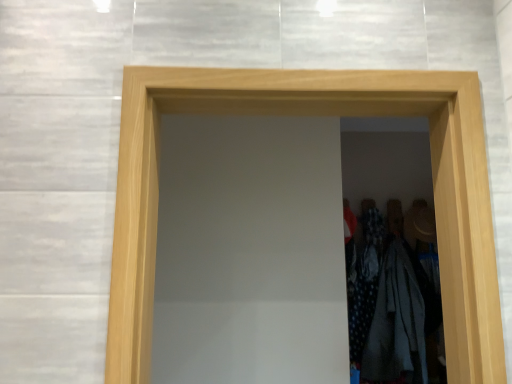
Question: Is polka dot fabric dress at right further to camera compared to natural wood door at center?

Choices:
 (A) no
 (B) yes

Answer: (B)

Question: Are polka dot fabric dress at right and natural wood door at center beside each other?

Choices:
 (A) yes
 (B) no

Answer: (B)

Question: Is polka dot fabric dress at right positioned with its back to natural wood door at center?

Choices:
 (A) yes
 (B) no

Answer: (B)

Question: Considering the relative sizes of polka dot fabric dress at right and natural wood door at center in the image provided, is polka dot fabric dress at right taller than natural wood door at center?

Choices:
 (A) no
 (B) yes

Answer: (B)

Question: Is there a large distance between polka dot fabric dress at right and natural wood door at center?

Choices:
 (A) yes
 (B) no

Answer: (A)

Question: Would you say natural wood door at center is inside or outside white cotton shirt at right?

Choices:
 (A) outside
 (B) inside

Answer: (A)

Question: From a real-world perspective, is natural wood door at center positioned above or below white cotton shirt at right?

Choices:
 (A) below
 (B) above

Answer: (B)

Question: In terms of size, does natural wood door at center appear bigger or smaller than white cotton shirt at right?

Choices:
 (A) small
 (B) big

Answer: (B)

Question: Is natural wood door at center in front of or behind white cotton shirt at right in the image?

Choices:
 (A) behind
 (B) front

Answer: (B)

Question: Is point (443, 306) positioned closer to the camera than point (355, 344)?

Choices:
 (A) closer
 (B) farther

Answer: (A)

Question: Relative to polka dot fabric dress at right, is natural wood door at center in front or behind?

Choices:
 (A) front
 (B) behind

Answer: (A)

Question: Which is correct: natural wood door at center is inside polka dot fabric dress at right, or outside of it?

Choices:
 (A) outside
 (B) inside

Answer: (A)

Question: From the image's perspective, relative to polka dot fabric dress at right, is natural wood door at center above or below?

Choices:
 (A) below
 (B) above

Answer: (B)

Question: Does point (360, 342) appear closer or farther from the camera than point (475, 185)?

Choices:
 (A) farther
 (B) closer

Answer: (A)

Question: Is polka dot fabric dress at right taller or shorter than natural wood door at center?

Choices:
 (A) tall
 (B) short

Answer: (A)